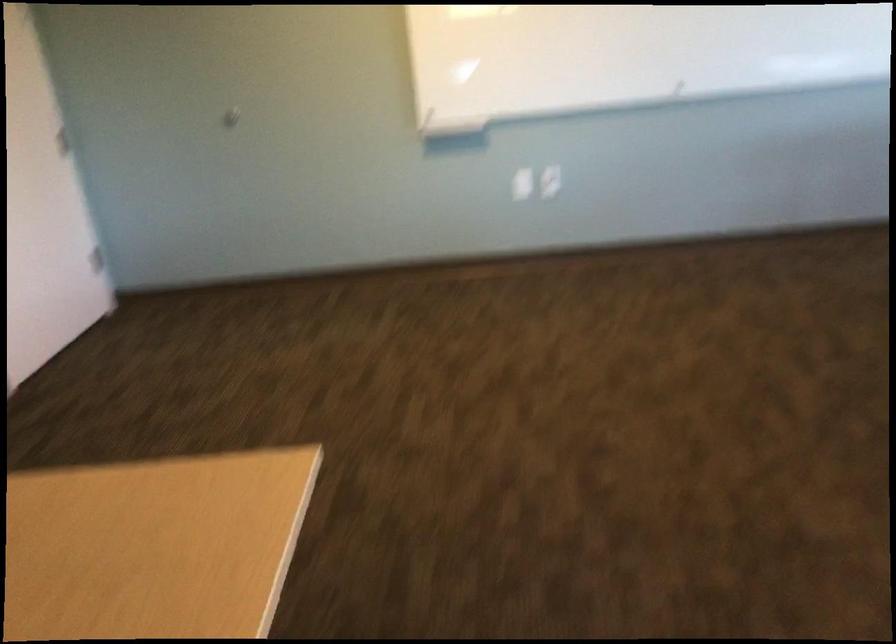
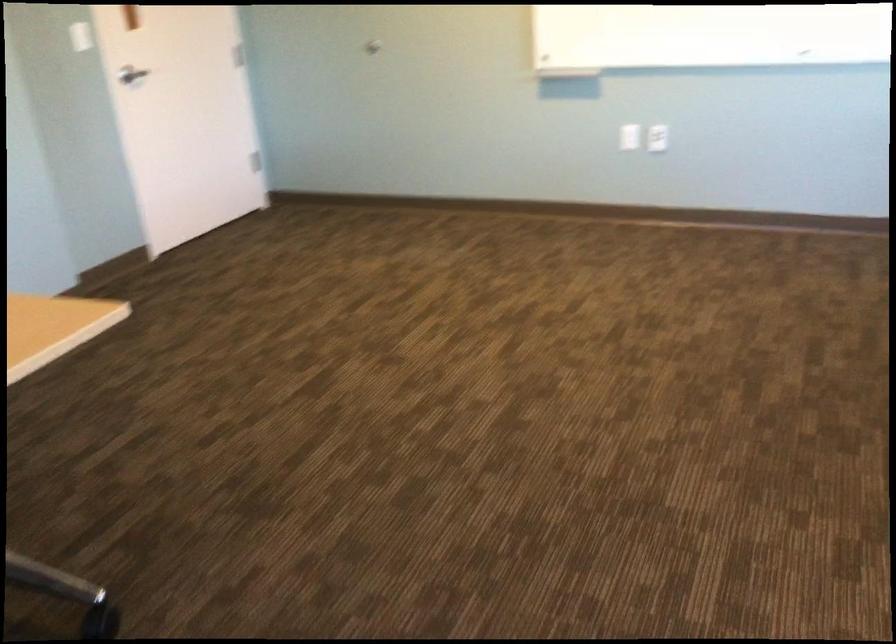
Locate, in the second image, the point that corresponds to point (549, 187) in the first image.

(657, 138)